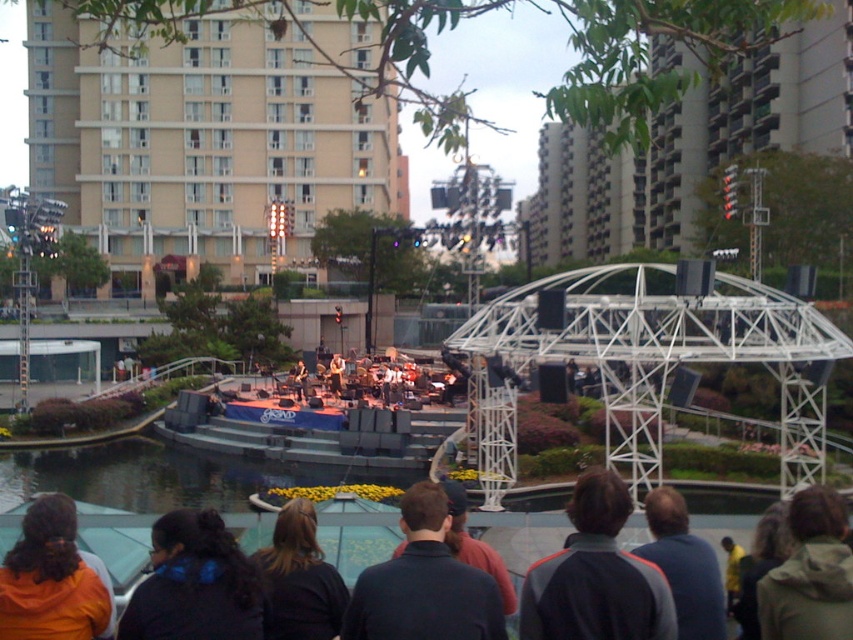
Does dark blue jacket at lower center have a larger size compared to orange fleece jacket at lower left?

Indeed, dark blue jacket at lower center has a larger size compared to orange fleece jacket at lower left.

Who is lower down, dark blue jacket at lower center or orange fleece jacket at lower left?

dark blue jacket at lower center

Where is `dark blue jacket at lower center`? Image resolution: width=853 pixels, height=640 pixels. dark blue jacket at lower center is located at coordinates (357, 534).

Can you confirm if dark blue shirt at center is wider than black fabric at center?

No.

Is dark blue shirt at center above black fabric at center?

Indeed, dark blue shirt at center is positioned over black fabric at center.

Is point (397, 625) farther from camera compared to point (242, 625)?

No, (397, 625) is in front of (242, 625).

The height and width of the screenshot is (640, 853). Find the location of `dark blue shirt at center`. dark blue shirt at center is located at coordinates (422, 582).

Who is higher up, black fabric at center or green fuzzy jacket at lower right?

green fuzzy jacket at lower right is above.

Does black fabric at center have a greater width compared to green fuzzy jacket at lower right?

Indeed, black fabric at center has a greater width compared to green fuzzy jacket at lower right.

Find the location of a particular element. The width and height of the screenshot is (853, 640). black fabric at center is located at coordinates (194, 582).

The image size is (853, 640). I want to click on black fabric at center, so click(x=194, y=582).